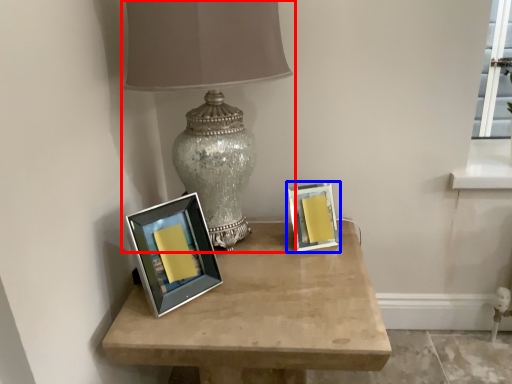
Question: Which of the following is the closest to the observer, lamp (highlighted by a red box) or picture frame (highlighted by a blue box)?

Choices:
 (A) lamp
 (B) picture frame

Answer: (A)